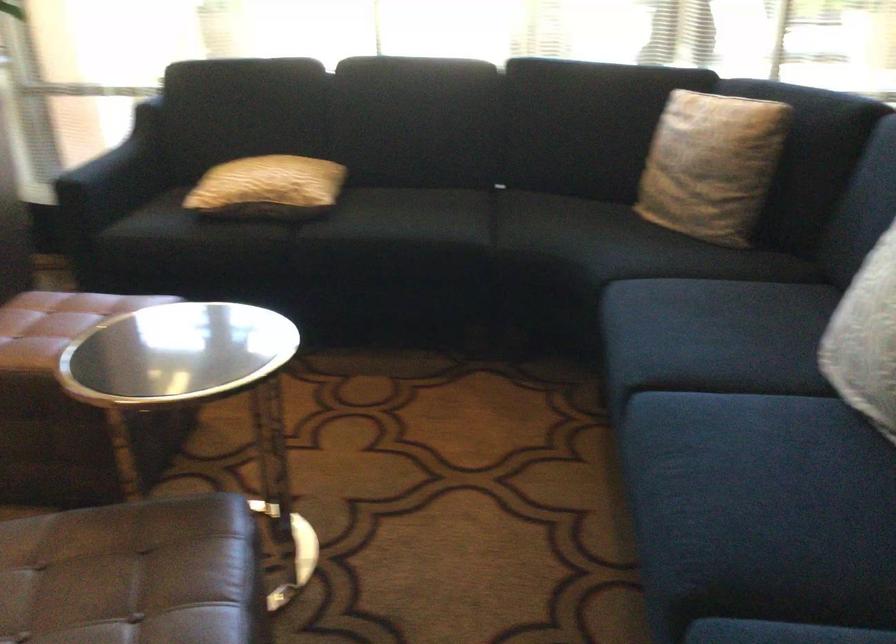
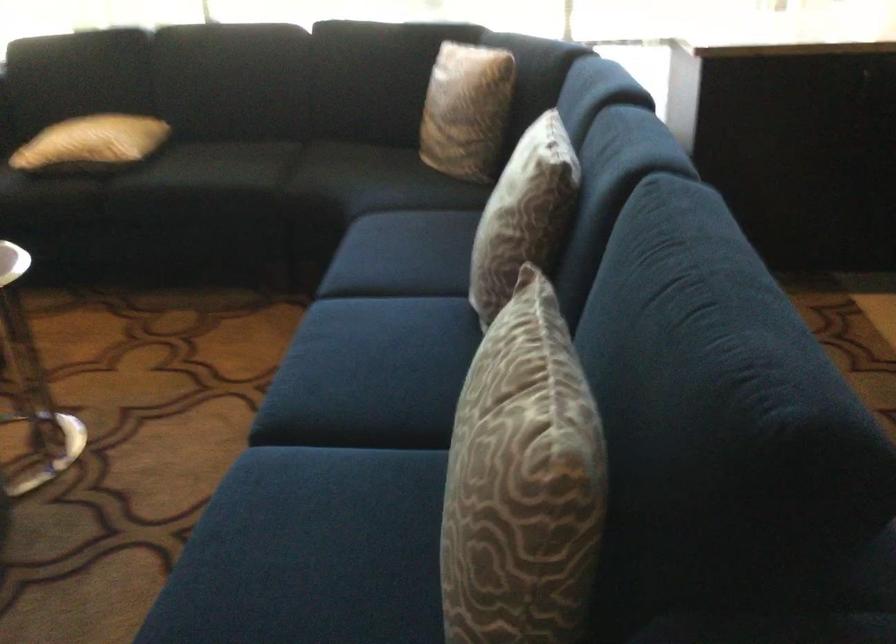
In the second image, find the point that corresponds to (721,164) in the first image.

(467, 109)